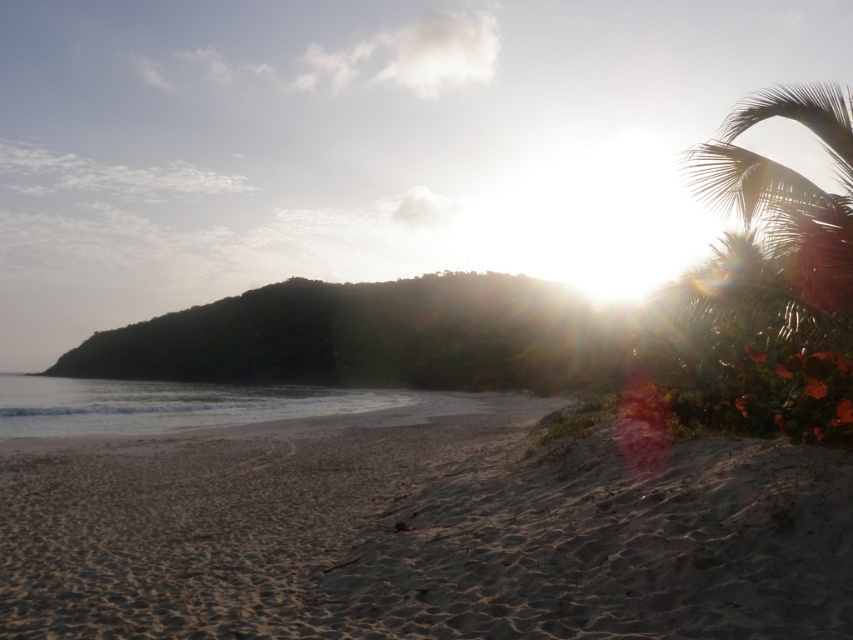
Question: Among these objects, which one is nearest to the camera?

Choices:
 (A) sandy beach at lower left
 (B) green leafy palm tree at upper right

Answer: (A)

Question: Which point appears closest to the camera in this image?

Choices:
 (A) 727,131
 (B) 125,518

Answer: (B)

Question: Does sandy beach at lower left have a lesser width compared to green leafy palm tree at upper right?

Choices:
 (A) no
 (B) yes

Answer: (B)

Question: Is sandy beach at lower left to the right of green leafy palm tree at upper right from the viewer's perspective?

Choices:
 (A) no
 (B) yes

Answer: (A)

Question: Where is sandy beach at lower left located in relation to green leafy palm tree at upper right in the image?

Choices:
 (A) below
 (B) above

Answer: (A)

Question: Among these points, which one is farthest from the camera?

Choices:
 (A) (547, 470)
 (B) (827, 125)

Answer: (A)